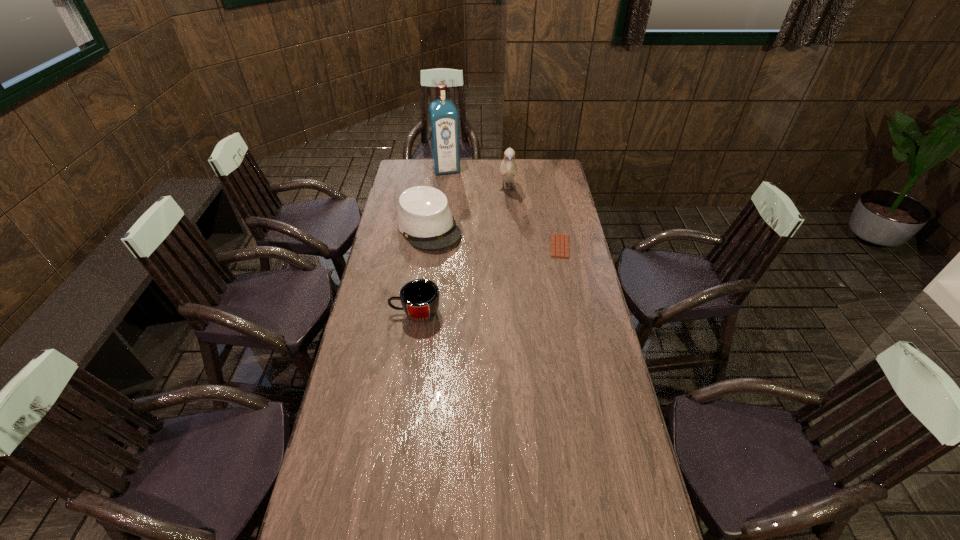
You are a GUI agent. You are given a task and a screenshot of the screen. Output one action in this format:
    pyautogui.click(x=<x>, y=<y>)
    Task: Click on the liquor present at the far edge
    The height and width of the screenshot is (540, 960).
    Given the screenshot: What is the action you would take?
    pyautogui.click(x=443, y=116)

I want to click on bird at the far edge, so [508, 169].

Where is `mug that is positioned at the left edge`? mug that is positioned at the left edge is located at coordinates (420, 298).

Locate an element on the screen. Image resolution: width=960 pixels, height=540 pixels. hat at the left edge is located at coordinates (424, 217).

The width and height of the screenshot is (960, 540). Find the location of `object present at the right edge`. object present at the right edge is located at coordinates (559, 242).

The width and height of the screenshot is (960, 540). Find the location of `free region at the left edge of the desktop`. free region at the left edge of the desktop is located at coordinates (409, 248).

The height and width of the screenshot is (540, 960). Identify the location of blank space at the right edge of the desktop. (548, 261).

At what (x,y) coordinates should I click in order to perform the action: click on vacant space at the far left corner. Please return your answer as a coordinate pair (x, y). The image size is (960, 540). Looking at the image, I should click on click(411, 167).

In the image, there is a desktop. Identify the location of vacant space at the near left corner. The image size is (960, 540). (361, 535).

The height and width of the screenshot is (540, 960). What are the coordinates of `vacant area at the far right corner of the desktop` in the screenshot? It's located at (538, 179).